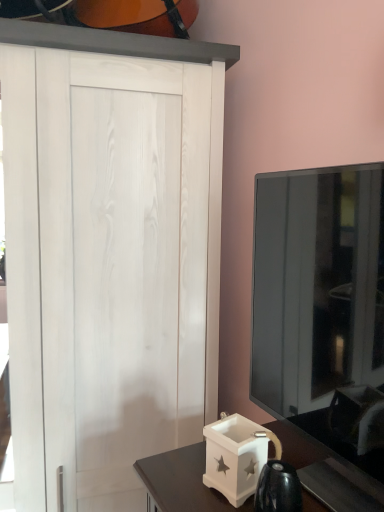
Image resolution: width=384 pixels, height=512 pixels. Find the location of `transparent glass tv at right`. transparent glass tv at right is located at coordinates (323, 320).

Describe the element at coordinates (323, 320) in the screenshot. The image size is (384, 512). I see `transparent glass tv at right` at that location.

In order to click on white matte box at lower right in this screenshot , I will do `click(235, 457)`.

This screenshot has width=384, height=512. What do you see at coordinates (235, 457) in the screenshot?
I see `white matte box at lower right` at bounding box center [235, 457].

Find the location of a particular element. transparent glass tv at right is located at coordinates (323, 320).

Considering the positions of objects transparent glass tv at right and white matte box at lower right in the image provided, who is more to the left, transparent glass tv at right or white matte box at lower right?

Positioned to the left is white matte box at lower right.

Is the depth of transparent glass tv at right less than that of white matte box at lower right?

Yes, it is.

Between point (374, 464) and point (246, 495), which one is positioned behind?

The point (374, 464) is behind.

From the image's perspective, is transparent glass tv at right located above or below white matte box at lower right?

From the image's perspective, transparent glass tv at right appears above white matte box at lower right.

From a real-world perspective, is transparent glass tv at right located beneath white matte box at lower right?

No, from a real-world perspective, transparent glass tv at right is not beneath white matte box at lower right.

Is transparent glass tv at right wider or thinner than white matte box at lower right?

Considering their sizes, transparent glass tv at right looks broader than white matte box at lower right.

Between transparent glass tv at right and white matte box at lower right, which one has less height?

white matte box at lower right is shorter.

Considering the sizes of objects transparent glass tv at right and white matte box at lower right in the image provided, who is smaller, transparent glass tv at right or white matte box at lower right?

Smaller between the two is white matte box at lower right.

Is white matte box at lower right surrounded by transparent glass tv at right?

No, white matte box at lower right is not inside transparent glass tv at right.

Can you see transparent glass tv at right touching white matte box at lower right?

No, transparent glass tv at right is not touching white matte box at lower right.

Is transparent glass tv at right oriented away from white matte box at lower right?

No, transparent glass tv at right is not facing the opposite direction of white matte box at lower right.

How different are the orientations of transparent glass tv at right and white matte box at lower right in degrees?

The angle between the facing direction of transparent glass tv at right and the facing direction of white matte box at lower right is 9.31 degrees.

How far apart are transparent glass tv at right and white matte box at lower right?

9.74 inches.

Locate an element on the screen. This screenshot has height=512, width=384. box behind the transparent glass tv at right is located at coordinates (235, 457).

Does white matte box at lower right appear on the left side of transparent glass tv at right?

Yes, white matte box at lower right is to the left of transparent glass tv at right.

Is white matte box at lower right further to the viewer compared to transparent glass tv at right?

Yes.

Considering the positions of points (224, 435) and (329, 178), is point (224, 435) farther from camera compared to point (329, 178)?

No, (224, 435) is closer to viewer.

From the image's perspective, who appears lower, white matte box at lower right or transparent glass tv at right?

white matte box at lower right.

From a real-world perspective, which is physically above, white matte box at lower right or transparent glass tv at right?

transparent glass tv at right, from a real-world perspective.

Between white matte box at lower right and transparent glass tv at right, which one has larger width?

Wider between the two is transparent glass tv at right.

Is white matte box at lower right shorter than transparent glass tv at right?

Yes.

Does white matte box at lower right have a smaller size compared to transparent glass tv at right?

Yes.

Is transparent glass tv at right a part of white matte box at lower right?

No, transparent glass tv at right is not a part of white matte box at lower right.

Based on the photo, is white matte box at lower right not near transparent glass tv at right?

No, white matte box at lower right is in close proximity to transparent glass tv at right.

Could you tell me if white matte box at lower right is facing transparent glass tv at right?

No.

How many degrees apart are the facing directions of white matte box at lower right and transparent glass tv at right?

The facing directions of white matte box at lower right and transparent glass tv at right are 9.31 degrees apart.

Measure the distance from white matte box at lower right to transparent glass tv at right.

white matte box at lower right is 9.74 inches away from transparent glass tv at right.

You are a GUI agent. You are given a task and a screenshot of the screen. Output one action in this format:
    pyautogui.click(x=<x>, y=<y>)
    Task: Click on the box beneath the transparent glass tv at right (from a real-world perspective)
    This screenshot has height=512, width=384.
    Given the screenshot: What is the action you would take?
    pyautogui.click(x=235, y=457)

Find the location of a particular element. box on the left of the transparent glass tv at right is located at coordinates (235, 457).

I want to click on box below the transparent glass tv at right (from a real-world perspective), so click(235, 457).